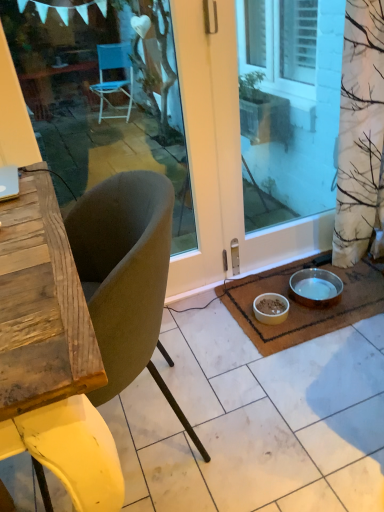
The height and width of the screenshot is (512, 384). I want to click on vacant area that is situated to the right of metallic silver bowl at lower right, marked as the second bowl in a left-to-right arrangement, so click(x=358, y=291).